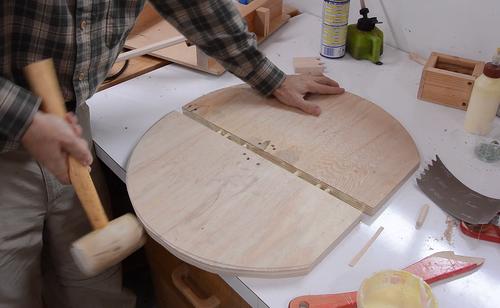
Find the location of a particular element. table is located at coordinates (137, 117).